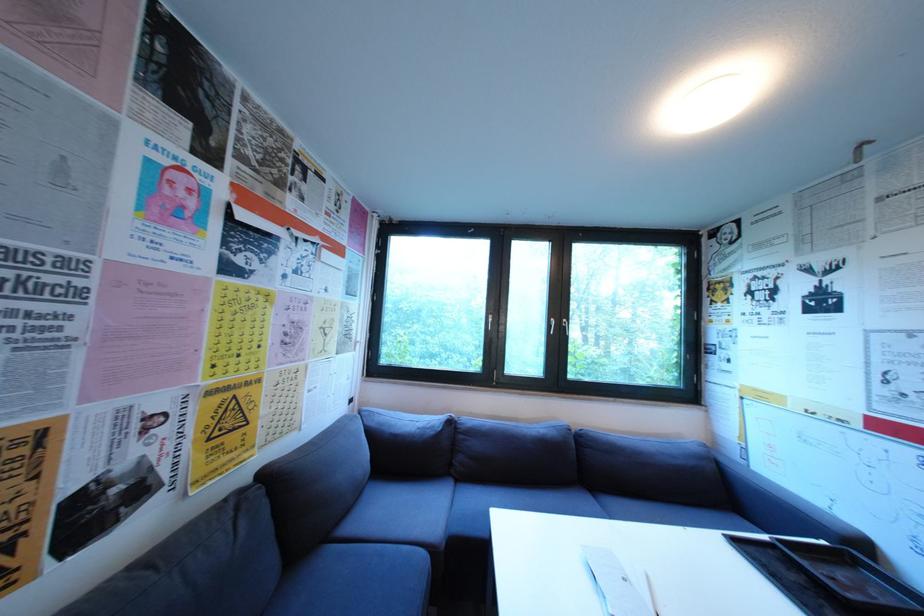
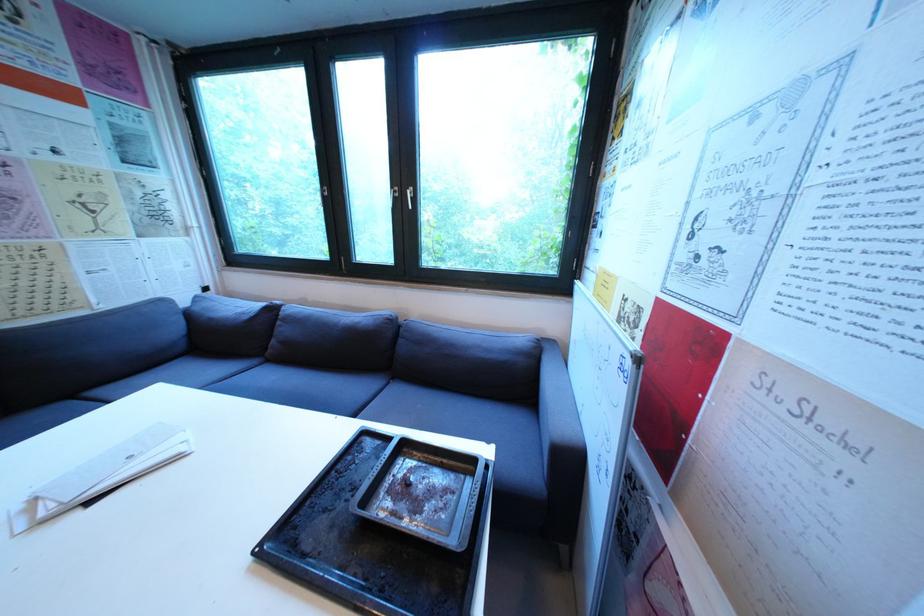
Question: The images are taken continuously from a first-person perspective. In which direction are you moving?

Choices:
 (A) Left
 (B) Right
 (C) Forward
 (D) Backward

Answer: (B)